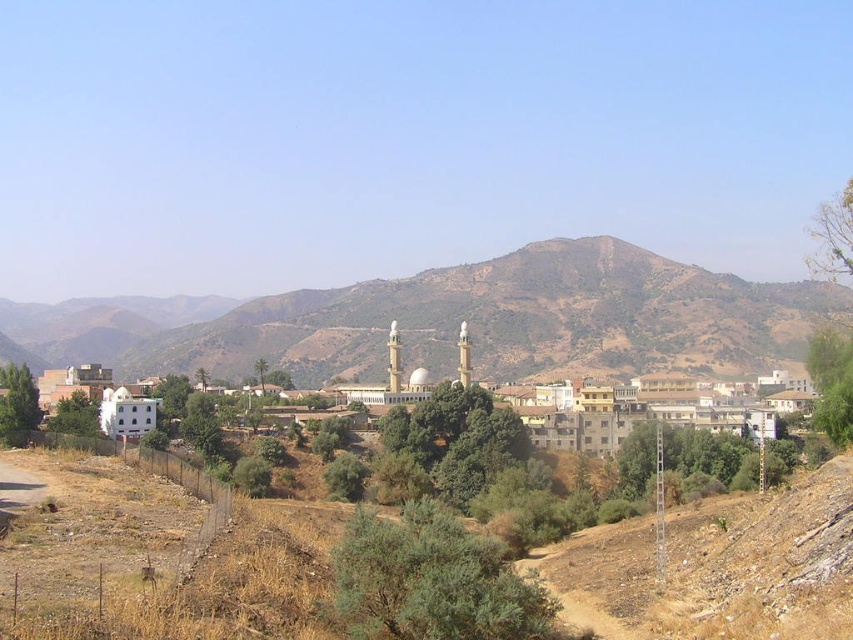
You are a hiker planning to drive a 3.5 meter wide truck along the brown dirt track at lower center near the brown rocky mountain at center. Based on the scene, can the truck safely pass through the track?

The brown dirt track at lower center is narrower than the brown rocky mountain at center, but the width comparison between the track and the truck is not provided. However, since the track is narrower than the mountain, it might not be wide enough for the truck. Further information about the track width is needed to confirm.

You are standing at the town square and see two points marked in the image. Which point is closer to you, point (666,344) or point (548,408)?

Point (548,408) is closer to you because it is less further away than point (666,344).

You are a tourist standing at the edge of the town looking towards the brown rocky mountain at center and the white matte building at center. Which object appears larger in the scene?

The brown rocky mountain at center appears larger than the white matte building at center because it is taller.